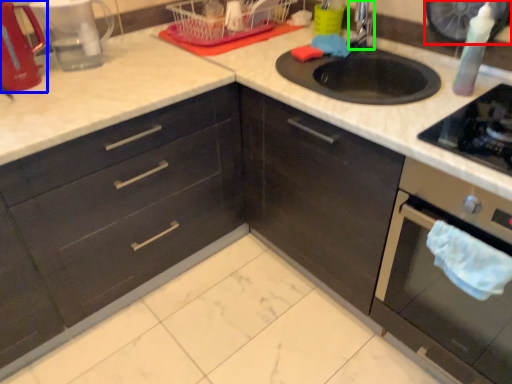
Question: Which is farther away from appliance (highlighted by a red box)? appliance (highlighted by a blue box) or faucet (highlighted by a green box)?

Choices:
 (A) appliance
 (B) faucet

Answer: (A)